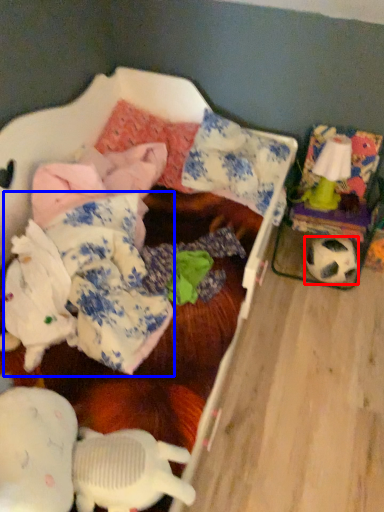
Question: Which of the following is the farthest to the observer, football (highlighted by a red box) or clothing (highlighted by a blue box)?

Choices:
 (A) football
 (B) clothing

Answer: (A)